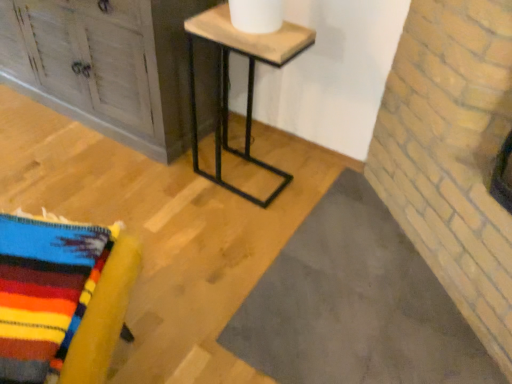
I want to click on free space in front of wooden/marble table at center, so pyautogui.click(x=219, y=233).